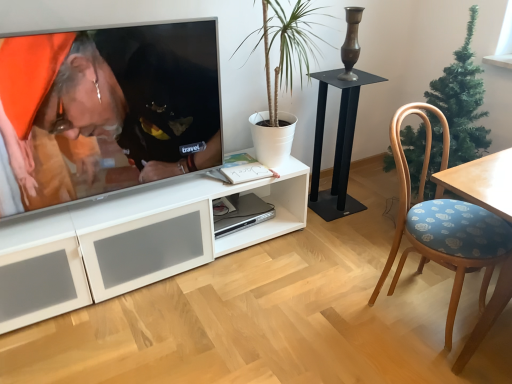
Measure the distance between green artificial christmas tree at right and camera.

green artificial christmas tree at right is 6.05 feet away from camera.

Describe the element at coordinates (101, 112) in the screenshot. The width and height of the screenshot is (512, 384). I see `matte black shirt at upper left` at that location.

Find the location of `sleek silver computer at center`. sleek silver computer at center is located at coordinates (239, 213).

Is white matte plant at center to the left of matte black shirt at upper left from the viewer's perspective?

No.

Is white matte plant at center with matte black shirt at upper left?

They are not placed beside each other.

Considering the sizes of objects white matte plant at center and matte black shirt at upper left in the image provided, who is shorter, white matte plant at center or matte black shirt at upper left?

With less height is matte black shirt at upper left.

Could you tell me if white matte plant at center is facing matte black shirt at upper left?

No, white matte plant at center is not turned towards matte black shirt at upper left.

Can you tell me how much green artificial christmas tree at right and wooden chair with blue floral cushion at right differ in facing direction?

The angle between the facing direction of green artificial christmas tree at right and the facing direction of wooden chair with blue floral cushion at right is 96.6 degrees.

How distant is green artificial christmas tree at right from wooden chair with blue floral cushion at right?

green artificial christmas tree at right and wooden chair with blue floral cushion at right are 12.95 inches apart.

Which point is more forward, (440, 86) or (483, 251)?

Positioned in front is point (483, 251).

Is green artificial christmas tree at right placed right next to wooden chair with blue floral cushion at right?

No.

Consider the image. Which object is positioned more to the left, black metal table at center or wooden chair with blue floral cushion at right?

black metal table at center.

What's the angular difference between black metal table at center and wooden chair with blue floral cushion at right's facing directions?

7.3 degrees.

Is black metal table at center far away from wooden chair with blue floral cushion at right?

black metal table at center is actually quite close to wooden chair with blue floral cushion at right.

Can you confirm if black metal table at center is smaller than wooden chair with blue floral cushion at right?

Yes.

Who is taller, sleek silver computer at center or black metal table at center?

With more height is black metal table at center.

Are sleek silver computer at center and black metal table at center located far from each other?

No, sleek silver computer at center is not far away from black metal table at center.

This screenshot has width=512, height=384. Identify the location of table above the sleek silver computer at center (from the image's perspective). (337, 145).

From the image's perspective, is black metal table at center on matte black shirt at upper left?

Incorrect, from the image's perspective, black metal table at center is lower than matte black shirt at upper left.

Is point (352, 82) closer or farther from the camera than point (56, 179)?

Clearly, point (352, 82) is more distant from the camera than point (56, 179).

Who is smaller, black metal table at center or matte black shirt at upper left?

black metal table at center is smaller.

Who is taller, black metal table at center or matte black shirt at upper left?

Standing taller between the two is black metal table at center.

From the image's perspective, is green artificial christmas tree at right over sleek silver computer at center?

Yes, from the image's perspective, green artificial christmas tree at right is on top of sleek silver computer at center.

Is green artificial christmas tree at right looking in the opposite direction of sleek silver computer at center?

That's not correct — green artificial christmas tree at right is not looking away from sleek silver computer at center.

Which point is more forward, (x=444, y=78) or (x=259, y=204)?

Point (x=444, y=78)

From a real-world perspective, is green artificial christmas tree at right on top of sleek silver computer at center?

Yes.

Based on the photo, how distant is white matte plant at center from sleek silver computer at center?

white matte plant at center and sleek silver computer at center are 30.09 inches apart from each other.

From the image's perspective, which one is positioned higher, white matte plant at center or sleek silver computer at center?

From the image's view, white matte plant at center is above.

Is sleek silver computer at center completely or partially inside white matte plant at center?

No, white matte plant at center does not contain sleek silver computer at center.

Locate an element on the screen. The width and height of the screenshot is (512, 384). person below the white matte plant at center (from the image's perspective) is located at coordinates (101, 112).

This screenshot has width=512, height=384. What are the coordinates of `christmas tree behind the wooden chair with blue floral cushion at right` in the screenshot? It's located at (462, 102).

Which object lies further to the anchor point wooden chair with blue floral cushion at right, black metal table at center or matte black shirt at upper left?

Among the two, matte black shirt at upper left is located further to wooden chair with blue floral cushion at right.

When comparing their distances from white matte plant at center, does green artificial christmas tree at right or matte black shirt at upper left seem further?

green artificial christmas tree at right.

Consider the image. From the image, which object appears to be nearer to green artificial christmas tree at right, matte black shirt at upper left or white matte plant at center?

Based on the image, white matte plant at center appears to be nearer to green artificial christmas tree at right.

Looking at the image, which one is located further to wooden chair with blue floral cushion at right, sleek silver computer at center or green artificial christmas tree at right?

sleek silver computer at center is further to wooden chair with blue floral cushion at right.

When comparing their distances from black metal table at center, does matte black shirt at upper left or wooden chair with blue floral cushion at right seem closer?

The object closer to black metal table at center is wooden chair with blue floral cushion at right.

Estimate the real-world distances between objects in this image. Which object is closer to matte black shirt at upper left, sleek silver computer at center or green artificial christmas tree at right?

Based on the image, sleek silver computer at center appears to be nearer to matte black shirt at upper left.

Looking at the image, which one is located further to white matte plant at center, black metal table at center or matte black shirt at upper left?

matte black shirt at upper left is further to white matte plant at center.

From the image, which object appears to be farther from black metal table at center, sleek silver computer at center or matte black shirt at upper left?

The object further to black metal table at center is matte black shirt at upper left.

The image size is (512, 384). What are the coordinates of `christmas tree between wooden chair with blue floral cushion at right and black metal table at center from front to back` in the screenshot? It's located at (462, 102).

Where is `houseplant situated between matte black shirt at upper left and green artificial christmas tree at right from left to right`? houseplant situated between matte black shirt at upper left and green artificial christmas tree at right from left to right is located at coordinates pos(287,47).

At what (x,y) coordinates should I click in order to perform the action: click on computer located between matte black shirt at upper left and green artificial christmas tree at right in the left-right direction. Please return your answer as a coordinate pair (x, y). The height and width of the screenshot is (384, 512). Looking at the image, I should click on (239, 213).

You are a GUI agent. You are given a task and a screenshot of the screen. Output one action in this format:
    pyautogui.click(x=<x>, y=<y>)
    Task: Click on the chair between white matte plant at center and green artificial christmas tree at right from left to right
    
    Given the screenshot: What is the action you would take?
    [x=442, y=223]